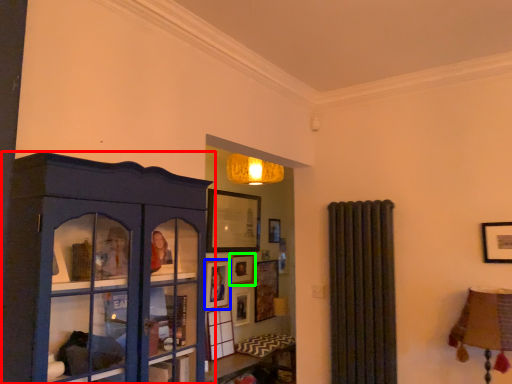
Question: Considering the real-world distances, which object is closest to shelf (highlighted by a red box)? picture frame (highlighted by a blue box) or picture frame (highlighted by a green box).

Choices:
 (A) picture frame
 (B) picture frame

Answer: (A)